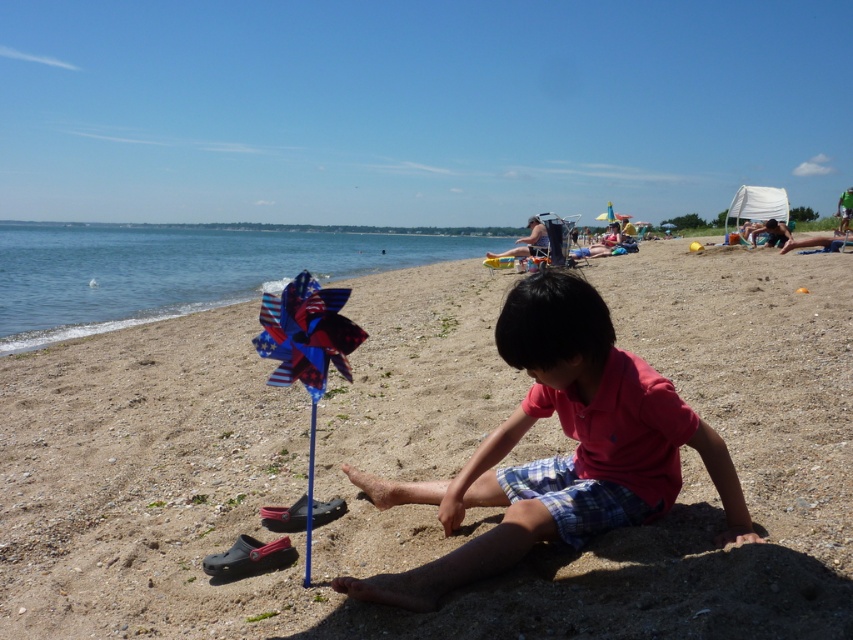
Question: Considering the relative positions of smooth sand at center and american flag pinwheel at center in the image provided, where is smooth sand at center located with respect to american flag pinwheel at center?

Choices:
 (A) above
 (B) below

Answer: (A)

Question: Where is pink cotton shirt at center located in relation to american flag pinwheel at center in the image?

Choices:
 (A) right
 (B) left

Answer: (A)

Question: Which point is closer to the camera?

Choices:
 (A) smooth sand at center
 (B) pink cotton shirt at center

Answer: (A)

Question: Is the position of smooth sand at center less distant than that of american flag pinwheel at center?

Choices:
 (A) yes
 (B) no

Answer: (A)

Question: Which of the following is the farthest from the observer?

Choices:
 (A) (718, 448)
 (B) (341, 316)

Answer: (B)

Question: Which point is closer to the camera?

Choices:
 (A) (10, 596)
 (B) (643, 381)
 (C) (346, 360)

Answer: (B)